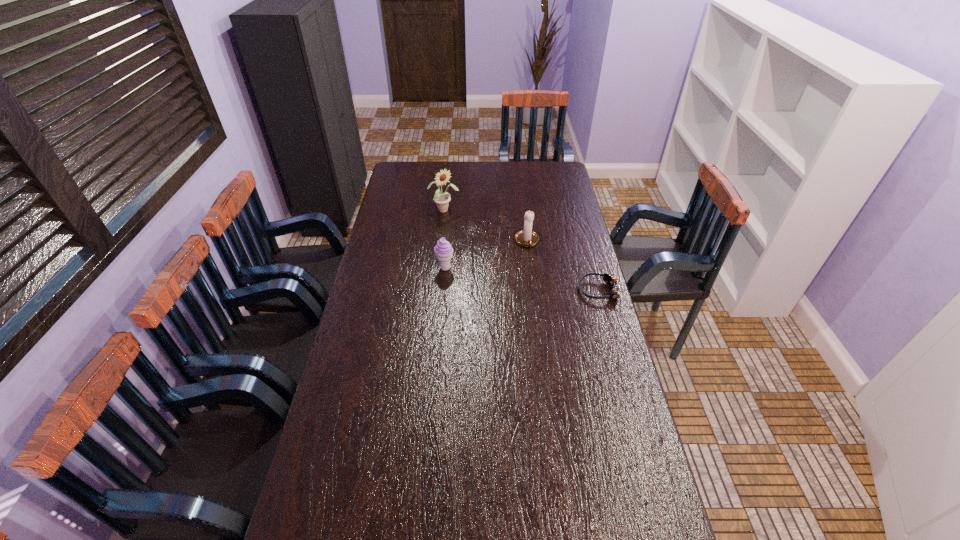
The height and width of the screenshot is (540, 960). What are the coordinates of `vacant area at the left edge` in the screenshot? It's located at click(407, 198).

This screenshot has width=960, height=540. In the image, there is a desktop. Find the location of `free space at the right edge`. free space at the right edge is located at coordinates 584,344.

In the image, there is a desktop. Where is `blank space at the far left corner`? blank space at the far left corner is located at coordinates (403, 178).

You are a GUI agent. You are given a task and a screenshot of the screen. Output one action in this format:
    pyautogui.click(x=<x>, y=<y>)
    Task: Click on the empty location between the third object from left to right and the rightmost object
    This screenshot has width=960, height=540.
    Given the screenshot: What is the action you would take?
    tap(563, 266)

I want to click on vacant space that's between the farthest object and the third nearest object, so click(x=486, y=226).

Find the location of a particular element. The width and height of the screenshot is (960, 540). vacant space that is in between the sunflower and the candle holder is located at coordinates (486, 226).

Find the location of `free spot between the tallest object and the shortest object`. free spot between the tallest object and the shortest object is located at coordinates (521, 251).

Find the location of a particular element. The height and width of the screenshot is (540, 960). blank region between the tallest object and the rightmost object is located at coordinates (x=521, y=251).

The image size is (960, 540). I want to click on free space between the second object from right to left and the tallest object, so click(x=486, y=226).

The height and width of the screenshot is (540, 960). What are the coordinates of `vacant space in between the shortest object and the farthest object` in the screenshot? It's located at (521, 251).